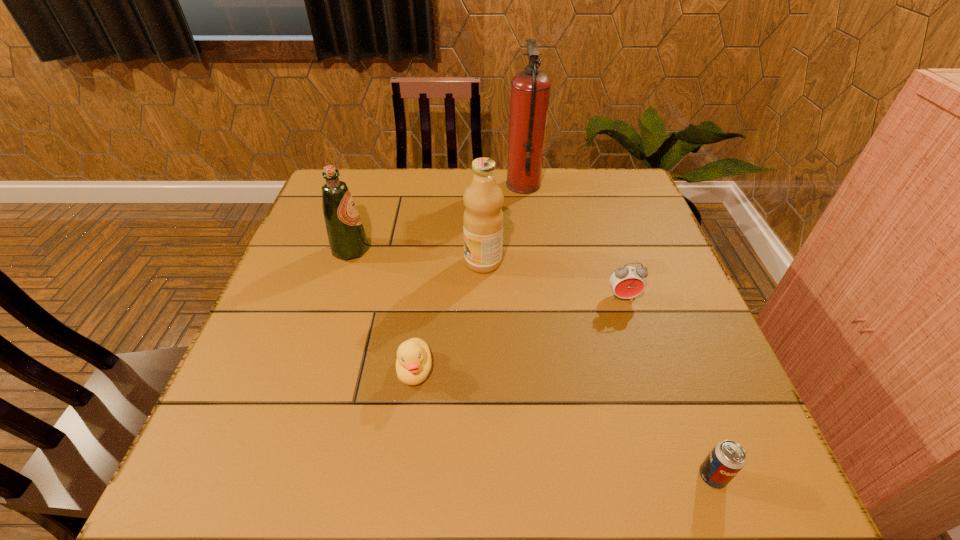
The image size is (960, 540). I want to click on free point between the fourth object from left to right and the nearest object, so 618,330.

Locate which object is the closest to the nearest object. Please provide its 2D coordinates. Your answer should be formatted as a tuple, i.e. [(x, y)], where the tuple contains the x and y coordinates of a point satisfying the conditions above.

[(627, 282)]

Identify the location of object that stands as the second closest to the fourth object from right to left. The width and height of the screenshot is (960, 540). (530, 89).

At what (x,y) coordinates should I click in order to perform the action: click on free space that satisfies the following two spatial constraints: 1. at the nozzle of the fourth object from left to right; 2. on the face of the fifth object from right to left. Please return your answer as a coordinate pair (x, y). Looking at the image, I should click on (547, 370).

You are a GUI agent. You are given a task and a screenshot of the screen. Output one action in this format:
    pyautogui.click(x=<x>, y=<y>)
    Task: Click on the vacant region that satisfies the following two spatial constraints: 1. at the nozzle of the farthest object; 2. on the face of the duckling
    
    Given the screenshot: What is the action you would take?
    pyautogui.click(x=547, y=370)

The width and height of the screenshot is (960, 540). I want to click on free region that satisfies the following two spatial constraints: 1. on the face of the nearest object; 2. on the right side of the fifth farthest object, so pos(401,476).

I want to click on vacant space that satisfies the following two spatial constraints: 1. on the label of the fourth object from right to left; 2. on the right side of the beer can, so [485, 476].